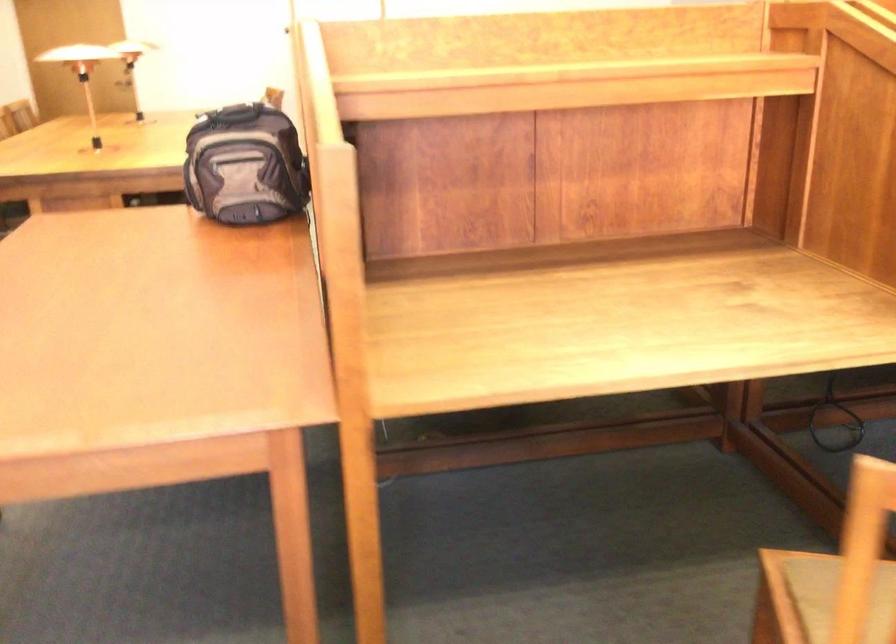
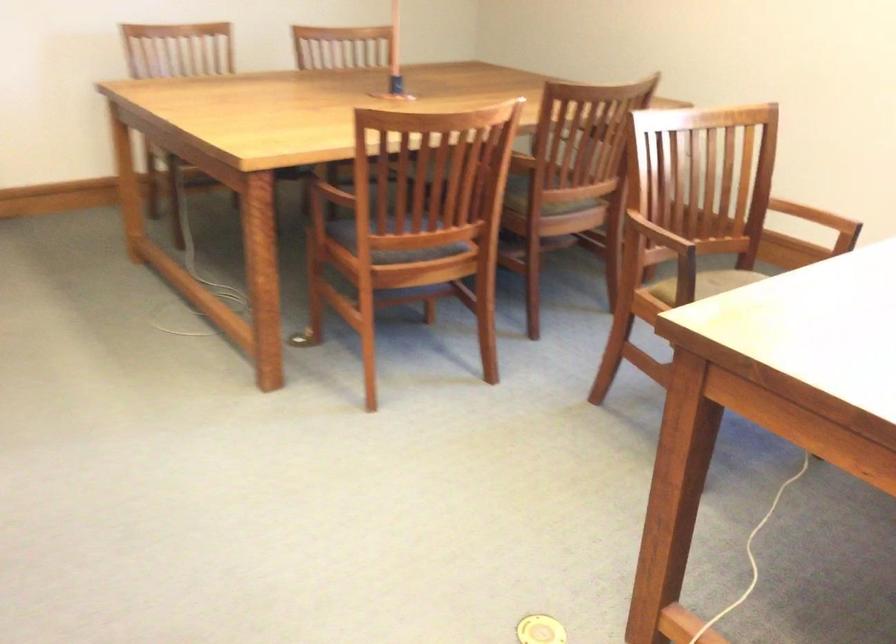
Based on the continuous images, in which direction is the camera rotating?

The rotation direction of the camera is right-down.